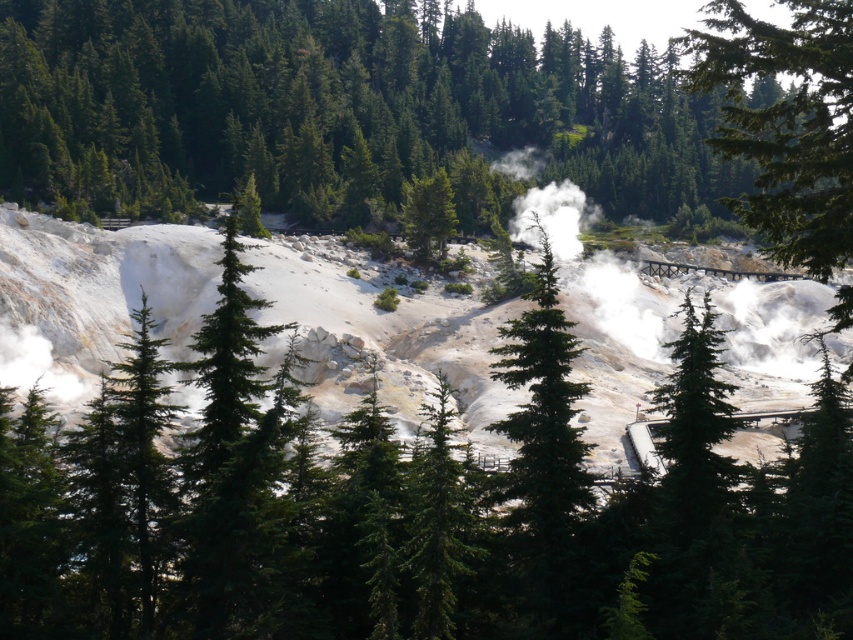
Question: Can you confirm if green textured tree at center is positioned to the left of green matte tree at center?

Choices:
 (A) no
 (B) yes

Answer: (A)

Question: Which of the following is the farthest from the observer?

Choices:
 (A) green matte tree at center
 (B) green textured tree at center

Answer: (A)

Question: Does green textured tree at center have a smaller size compared to green matte tree at center?

Choices:
 (A) no
 (B) yes

Answer: (A)

Question: From the image, what is the correct spatial relationship of green textured tree at center in relation to green matte tree at center?

Choices:
 (A) left
 (B) right

Answer: (B)